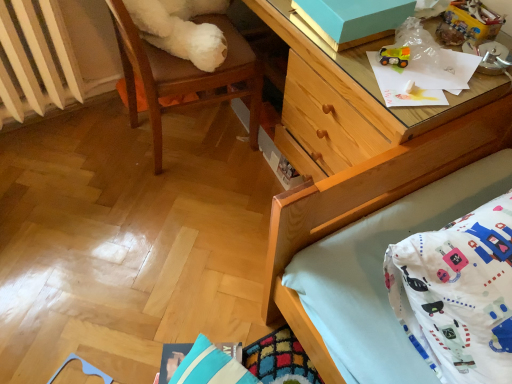
Identify the location of vacant area that is in front of matte blue cardboard box at upper right. (375, 74).